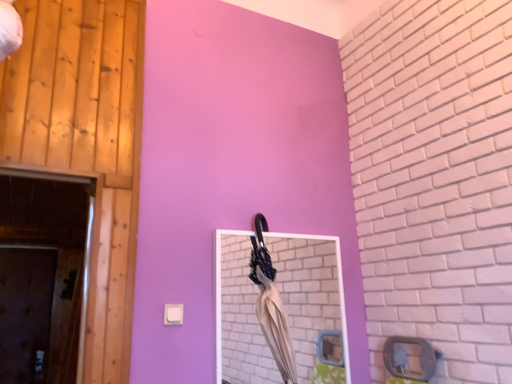
Question: From the image's perspective, is matte white mirror at center located beneath wooden at left, which ranks as the second door in bottom-to-top order?

Choices:
 (A) yes
 (B) no

Answer: (A)

Question: From a real-world perspective, is matte white mirror at center beneath wooden at left, which is counted as the first door, starting from the right?

Choices:
 (A) no
 (B) yes

Answer: (B)

Question: Are matte white mirror at center and wooden at left, marked as the second door in a left-to-right arrangement, located far from each other?

Choices:
 (A) yes
 (B) no

Answer: (A)

Question: From a real-world perspective, is matte white mirror at center over wooden at left, arranged as the second door when viewed from the back?

Choices:
 (A) yes
 (B) no

Answer: (B)

Question: Considering the relative positions of matte white mirror at center and wooden at left, arranged as the second door when viewed from the back, in the image provided, is matte white mirror at center to the left of wooden at left, arranged as the second door when viewed from the back, from the viewer's perspective?

Choices:
 (A) no
 (B) yes

Answer: (A)

Question: In the image, is wooden at left, which is counted as the first door, starting from the right, on the left side or the right side of brown matte door at lower left, which is the second door in right-to-left order?

Choices:
 (A) left
 (B) right

Answer: (B)

Question: In terms of height, does wooden at left, which is counted as the first door, starting from the right, look taller or shorter compared to brown matte door at lower left, which is counted as the first door, starting from the back?

Choices:
 (A) short
 (B) tall

Answer: (B)

Question: From a real-world perspective, is wooden at left, which ranks as the second door in bottom-to-top order, above or below brown matte door at lower left, which is counted as the first door, starting from the back?

Choices:
 (A) below
 (B) above

Answer: (B)

Question: From the image's perspective, is wooden at left, marked as the second door in a left-to-right arrangement, positioned above or below brown matte door at lower left, which ranks as the 1th door in left-to-right order?

Choices:
 (A) above
 (B) below

Answer: (A)

Question: Is point (117, 11) closer or farther from the camera than point (287, 294)?

Choices:
 (A) closer
 (B) farther

Answer: (A)

Question: Is wooden at left, the 1th door when ordered from top to bottom, in front of or behind matte white mirror at center in the image?

Choices:
 (A) front
 (B) behind

Answer: (A)

Question: Is wooden at left, the 1th door when ordered from top to bottom, wider or thinner than matte white mirror at center?

Choices:
 (A) wide
 (B) thin

Answer: (B)

Question: Is wooden at left, the first door positioned from the front, bigger or smaller than matte white mirror at center?

Choices:
 (A) small
 (B) big

Answer: (B)

Question: Considering the positions of matte white mirror at center and beige fabric umbrella at center in the image, is matte white mirror at center taller or shorter than beige fabric umbrella at center?

Choices:
 (A) tall
 (B) short

Answer: (B)

Question: Is point (224, 314) closer or farther from the camera than point (283, 355)?

Choices:
 (A) closer
 (B) farther

Answer: (B)